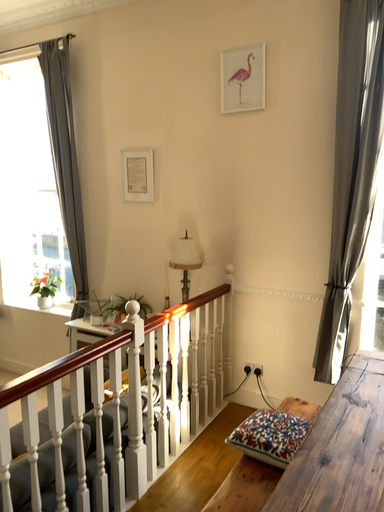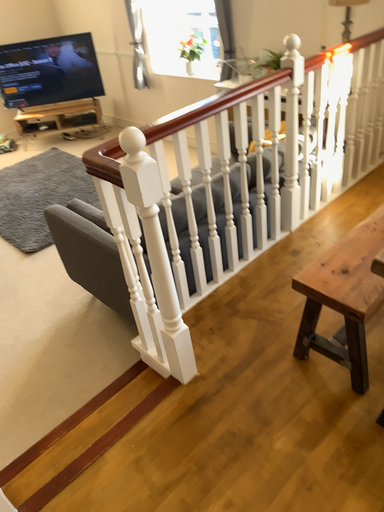
Question: How did the camera likely rotate when shooting the video?

Choices:
 (A) rotated upward
 (B) rotated downward

Answer: (B)